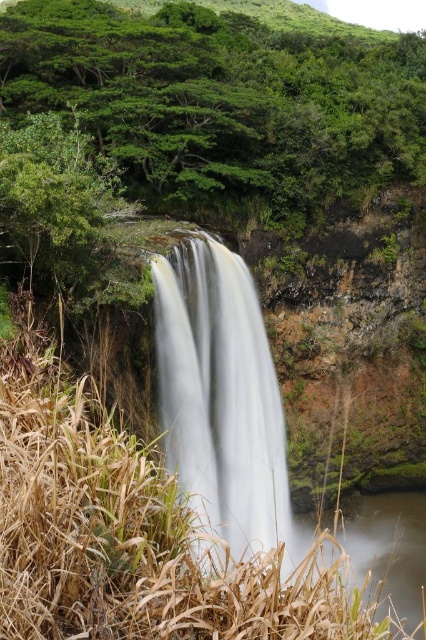
You are standing at the edge of the cliff overlooking the scene. You want to take a photo of the clear water at bottom right without the white smooth waterfall at center blocking the view. Is this possible?

The white smooth waterfall at center is in front of the clear water at bottom right, so it will block the view. Move to a position where the waterfall is not between you and the clear water at bottom right to take the photo.

Consider the image. You are a hiker who wants to take a photo of the clear water at bottom right. There are green leafy trees at upper left blocking the view. Can you move to the right side to get a better shot without the trees in the frame?

The green leafy trees at upper left are in front of the clear water at bottom right, so moving to the right side might allow you to position yourself where the trees no longer block the view of the clear water at bottom right.

You are standing at the base of the waterfall and want to take a photo of the green leafy trees at upper left. If your camera has a maximum zoom range of 30 meters, will you be able to capture the trees clearly?

The green leafy trees at upper left are 29.36 meters away from the viewer. Since the camera can zoom up to 30 meters, it is within range, so yes, you can capture the trees clearly.